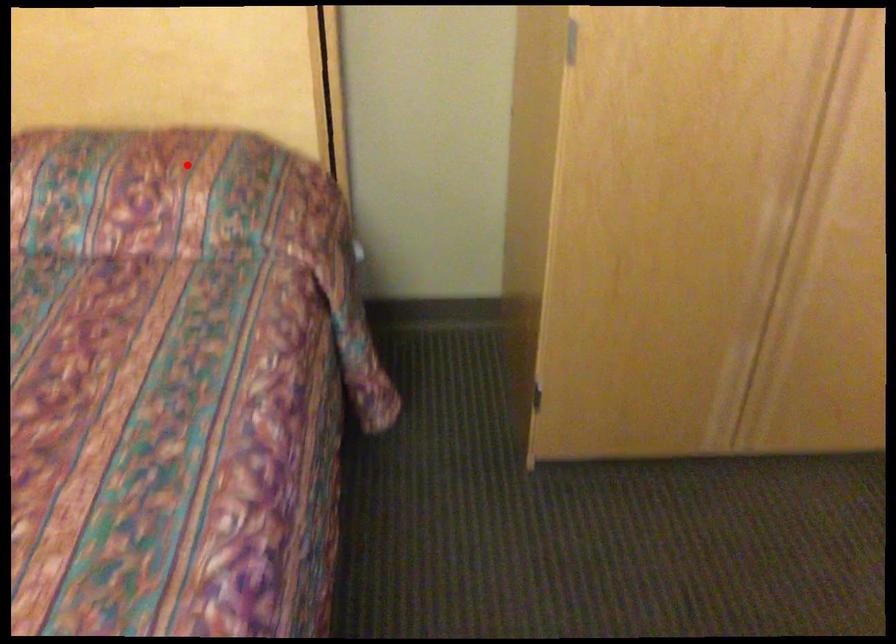
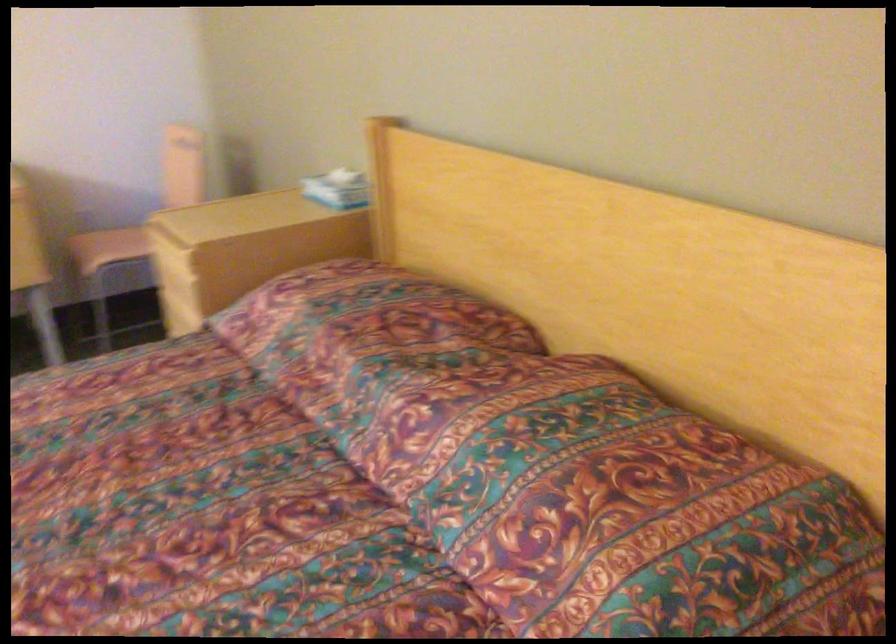
Question: I am providing you with two images of the same scene from different viewpoints. In image1, a red point is highlighted. Considering the same 3D point in image2, which of the following is correct?

Choices:
 (A) It is closer
 (B) It is farther

Answer: (A)